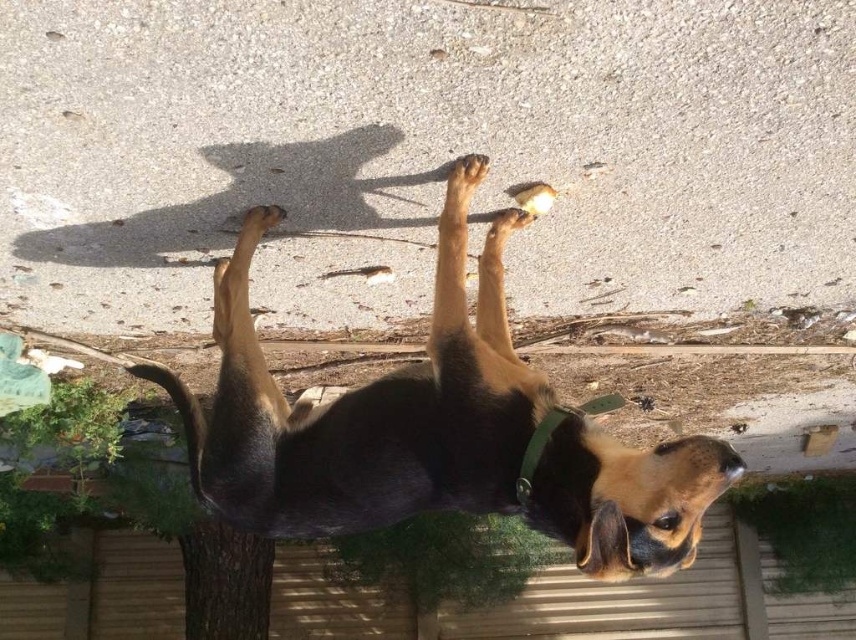
Question: Which point is farther from the camera taking this photo?

Choices:
 (A) (513, 211)
 (B) (479, 326)
 (C) (465, 195)

Answer: (B)

Question: Considering the real-world distances, which object is closest to the brown fur paw at upper center?

Choices:
 (A) brown fuzzy paw at upper center
 (B) black fur dog at center

Answer: (A)

Question: Is black fur dog at center to the right of brown fur paw at upper center from the viewer's perspective?

Choices:
 (A) yes
 (B) no

Answer: (B)

Question: Is the position of black fur dog at center less distant than that of brown fur paw at upper center?

Choices:
 (A) no
 (B) yes

Answer: (B)

Question: Based on their relative distances, which object is farther from the brown fuzzy paw at upper center?

Choices:
 (A) black fur dog at center
 (B) brown fur paw at upper center

Answer: (A)

Question: Is black fur dog at center bigger than brown fur paw at upper center?

Choices:
 (A) no
 (B) yes

Answer: (B)